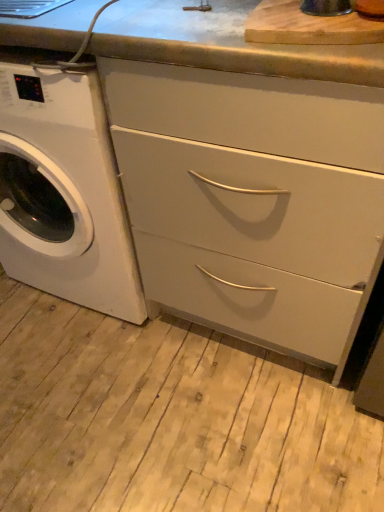
Question: Is matte white drawers at center far away from wooden cutting board at upper center?

Choices:
 (A) no
 (B) yes

Answer: (A)

Question: Is wooden cutting board at upper center at the back of matte white drawers at center?

Choices:
 (A) yes
 (B) no

Answer: (B)

Question: From the image's perspective, would you say matte white drawers at center is positioned over wooden cutting board at upper center?

Choices:
 (A) no
 (B) yes

Answer: (A)

Question: Can you confirm if matte white drawers at center is thinner than wooden cutting board at upper center?

Choices:
 (A) no
 (B) yes

Answer: (A)

Question: From a real-world perspective, is matte white drawers at center under wooden cutting board at upper center?

Choices:
 (A) yes
 (B) no

Answer: (A)

Question: Is the depth of matte white drawers at center less than that of wooden cutting board at upper center?

Choices:
 (A) no
 (B) yes

Answer: (B)

Question: From a real-world perspective, is white glossy washing machine at left located beneath matte white drawers at center?

Choices:
 (A) no
 (B) yes

Answer: (A)

Question: From a real-world perspective, is white glossy washing machine at left physically above matte white drawers at center?

Choices:
 (A) no
 (B) yes

Answer: (B)

Question: Is white glossy washing machine at left outside matte white drawers at center?

Choices:
 (A) yes
 (B) no

Answer: (A)

Question: Does white glossy washing machine at left have a larger size compared to matte white drawers at center?

Choices:
 (A) yes
 (B) no

Answer: (B)

Question: Considering the relative sizes of white glossy washing machine at left and matte white drawers at center in the image provided, is white glossy washing machine at left taller than matte white drawers at center?

Choices:
 (A) no
 (B) yes

Answer: (B)

Question: From the image's perspective, would you say white glossy washing machine at left is shown under matte white drawers at center?

Choices:
 (A) yes
 (B) no

Answer: (B)

Question: Does wooden cutting board at upper center touch matte white drawers at center?

Choices:
 (A) yes
 (B) no

Answer: (B)